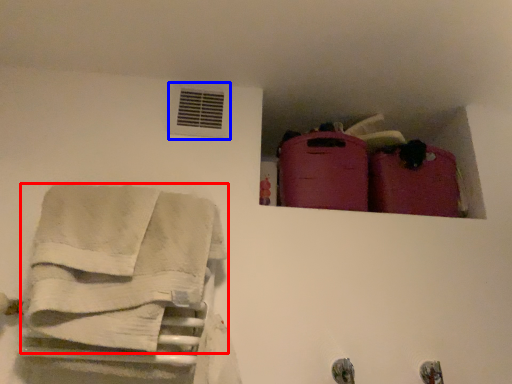
Question: Which object is closer to the camera taking this photo, towel (highlighted by a red box) or air conditioning (highlighted by a blue box)?

Choices:
 (A) towel
 (B) air conditioning

Answer: (A)